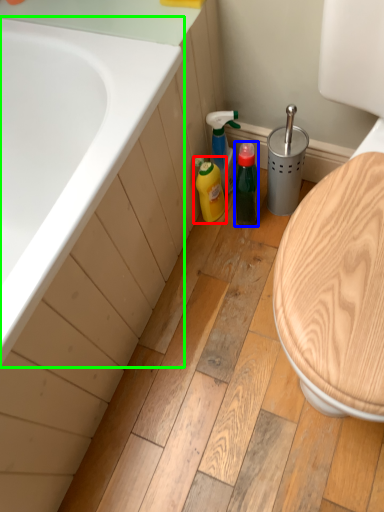
Question: Based on their relative distances, which object is nearer to cleaning product (highlighted by a red box)? Choose from bottle (highlighted by a blue box) and bathtub (highlighted by a green box).

Choices:
 (A) bottle
 (B) bathtub

Answer: (A)